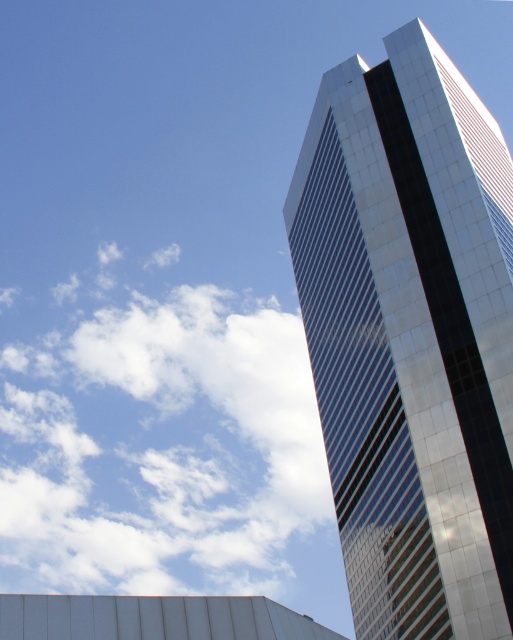
Question: Which point appears farthest from the camera in this image?

Choices:
 (A) (28, 419)
 (B) (418, 564)

Answer: (A)

Question: Is glossy glass tower at upper right bigger than white fluffy cloud at upper left?

Choices:
 (A) no
 (B) yes

Answer: (A)

Question: Observing the image, what is the correct spatial positioning of glossy glass tower at upper right in reference to white fluffy cloud at upper left?

Choices:
 (A) above
 (B) below

Answer: (A)

Question: Which object is farther from the camera taking this photo?

Choices:
 (A) glossy glass tower at upper right
 (B) white fluffy cloud at upper left

Answer: (B)

Question: Does glossy glass tower at upper right appear over white fluffy cloud at upper left?

Choices:
 (A) yes
 (B) no

Answer: (A)

Question: Which point is closer to the camera?

Choices:
 (A) white fluffy cloud at upper left
 (B) glossy glass tower at upper right

Answer: (B)